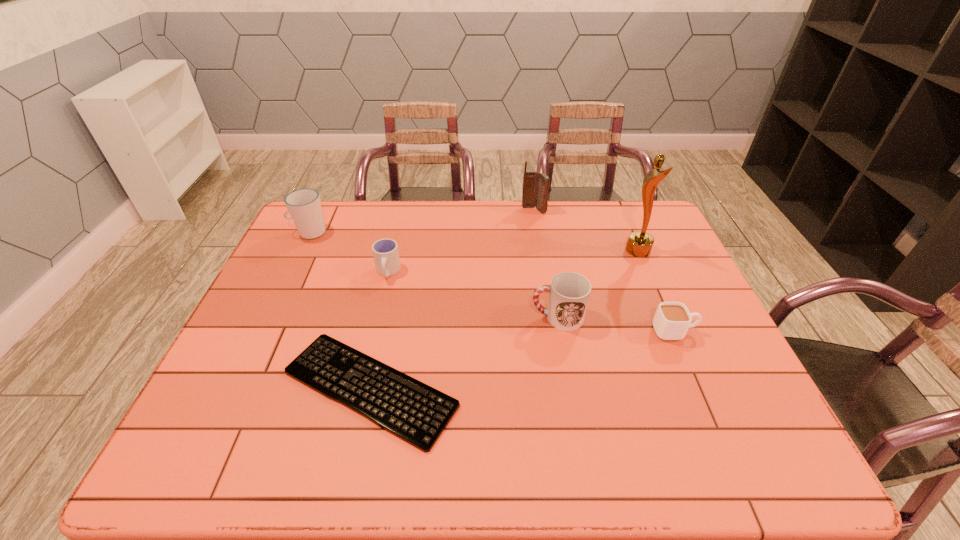
Select which cup appears as the closest to the shortest cup. Please provide its 2D coordinates. Your answer should be formatted as a tuple, i.e. [(x, y)], where the tuple contains the x and y coordinates of a point satisfying the conditions above.

[(569, 292)]

The width and height of the screenshot is (960, 540). Find the location of `cup that is the third closest one to the tallest object`. cup that is the third closest one to the tallest object is located at coordinates (385, 251).

The image size is (960, 540). In order to click on vacant region that satisfies the following two spatial constraints: 1. with the handle on the side of the third shortest object; 2. on the handle side of the fourth shortest object in this screenshot , I will do `click(377, 317)`.

Find the location of a particular element. The width and height of the screenshot is (960, 540). free location that satisfies the following two spatial constraints: 1. on the handle side of the fourth tallest object; 2. with a handle on the side of the leftmost cup is located at coordinates click(542, 232).

You are a GUI agent. You are given a task and a screenshot of the screen. Output one action in this format:
    pyautogui.click(x=<x>, y=<y>)
    Task: Click on the free space that satisfies the following two spatial constraints: 1. on the handle side of the fourth shortest object; 2. with a handle on the side of the farthest cup
    This screenshot has height=540, width=960.
    Given the screenshot: What is the action you would take?
    pyautogui.click(x=542, y=232)

You are a GUI agent. You are given a task and a screenshot of the screen. Output one action in this format:
    pyautogui.click(x=<x>, y=<y>)
    Task: Click on the free region that satisfies the following two spatial constraints: 1. on the handle side of the third cup from left to right; 2. with the handle on the side of the second cup from left to right
    The height and width of the screenshot is (540, 960).
    Given the screenshot: What is the action you would take?
    pyautogui.click(x=549, y=272)

Locate an element on the screen. blank area in the image that satisfies the following two spatial constraints: 1. on the handle side of the fourth shortest object; 2. on the keyboard of the sixth shortest object is located at coordinates (539, 211).

You are a GUI agent. You are given a task and a screenshot of the screen. Output one action in this format:
    pyautogui.click(x=<x>, y=<y>)
    Task: Click on the blank space that satisfies the following two spatial constraints: 1. on the keyboard of the farthest object; 2. on the handle side of the third cup from left to right
    The image size is (960, 540).
    Given the screenshot: What is the action you would take?
    pyautogui.click(x=551, y=317)

I want to click on free space that satisfies the following two spatial constraints: 1. with a handle on the side of the farthest cup; 2. on the handle side of the fourth shortest object, so [x=269, y=317].